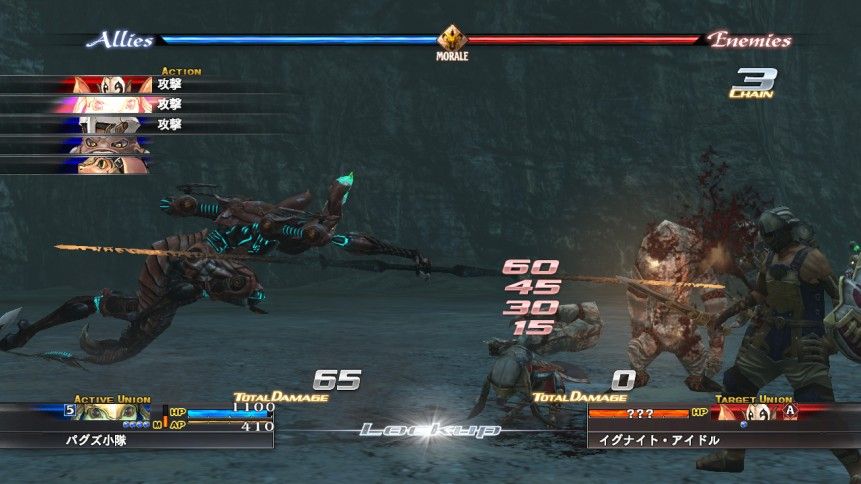
The width and height of the screenshot is (861, 484). What are the coordinates of `wall` in the screenshot? It's located at (447, 154).